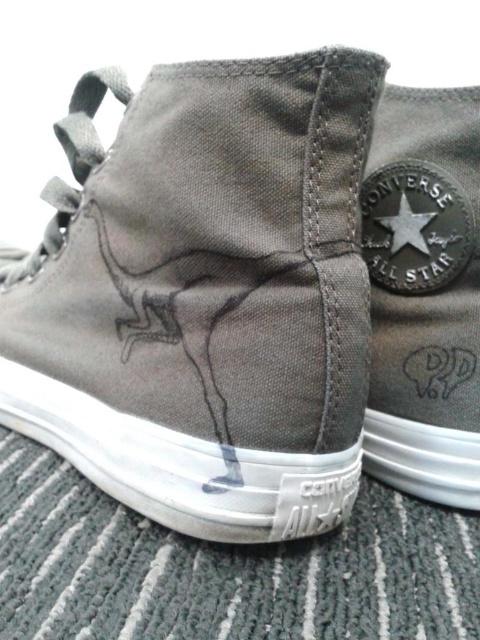
Question: Can you confirm if canvas high-top sneaker at center is positioned above metallic silver star at center?

Choices:
 (A) yes
 (B) no

Answer: (B)

Question: Is canvas high-top sneaker at center thinner than matte canvas converse all star at center?

Choices:
 (A) yes
 (B) no

Answer: (B)

Question: From the image, what is the correct spatial relationship of canvas high-top sneaker at center in relation to matte canvas converse all star at center?

Choices:
 (A) above
 (B) below

Answer: (A)

Question: Which object is the farthest from the metallic silver star at center?

Choices:
 (A) canvas high-top sneaker at center
 (B) matte canvas converse all star at center

Answer: (A)

Question: Among these objects, which one is nearest to the camera?

Choices:
 (A) metallic silver star at center
 (B) matte canvas converse all star at center

Answer: (B)

Question: Which point appears farthest from the camera in this image?

Choices:
 (A) (72, 282)
 (B) (397, 243)

Answer: (A)